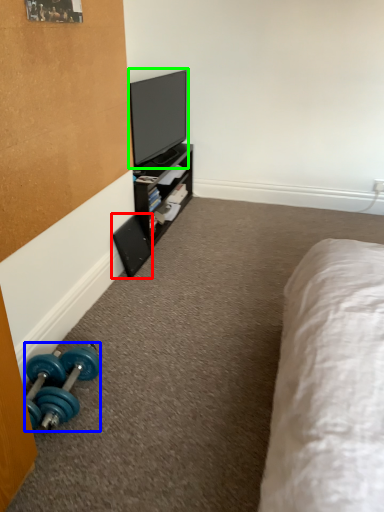
Question: Considering the real-world distances, which object is farthest from speaker (highlighted by a red box)? dumbbell (highlighted by a blue box) or television (highlighted by a green box)?

Choices:
 (A) dumbbell
 (B) television

Answer: (A)